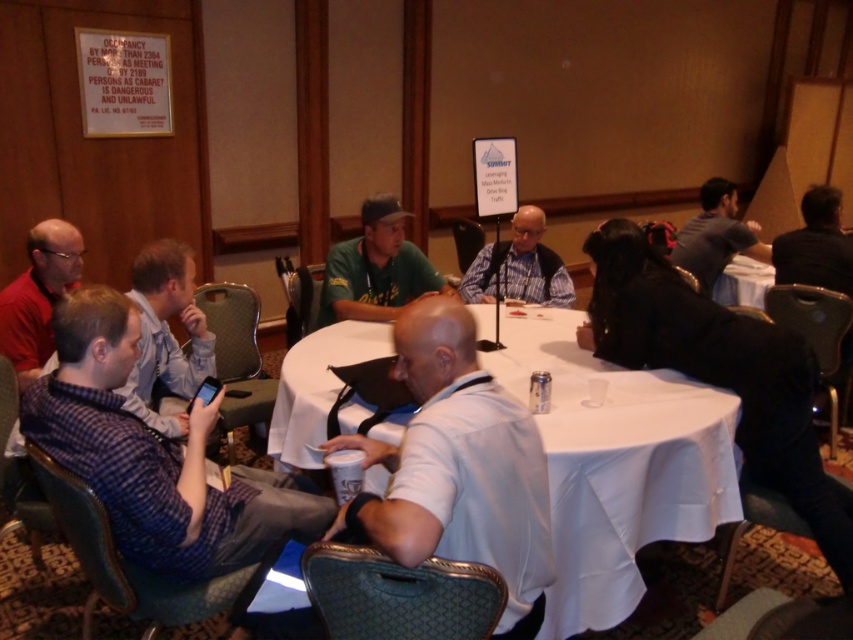
From the picture: You are standing at the entrance of the conference room and see the white matte shirt at center and the black leather jacket at upper right. If you want to reach both items quickly, which one should you approach first?

The white matte shirt at center is closer to you than the black leather jacket at upper right, so you should approach the white matte shirt at center first.

You are organizing a photo shoot and need to ensure that the red matte shirt at left and the black leather jacket at upper right are visible in the frame. Given that the camera has a fixed focal length, which object should you prioritize positioning closer to the camera to ensure both are in focus?

The red matte shirt at left should be positioned closer to the camera because its width is smaller than the black leather jacket at upper right, allowing it to be captured clearly without overfilling the frame.

You are a photographer positioned behind the group at the round table. You want to capture a photo that includes both the white matte shirt at center and the black leather jacket at upper right. Considering their heights, which object should you focus on first to ensure both are in frame?

The white matte shirt at center has a greater height compared to the black leather jacket at upper right. Therefore, you should focus on the white matte shirt at center first to ensure both are in frame, as it is taller and might require adjusting the camera angle to include both.